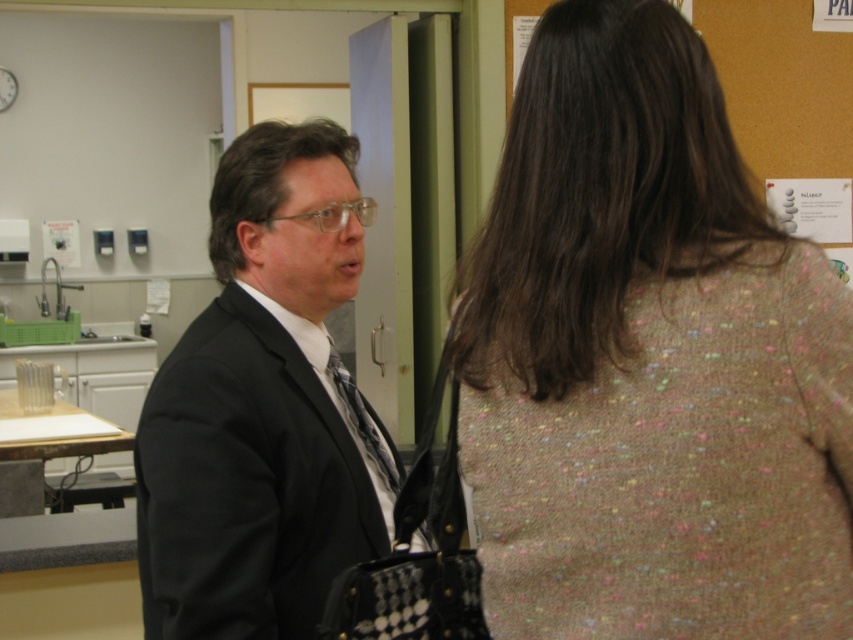
Question: Based on their relative distances, which object is farther from the speckled wool sweater at upper right?

Choices:
 (A) patterned silk tie at center
 (B) black matte suit at center

Answer: (A)

Question: Which object is farther from the camera taking this photo?

Choices:
 (A) black matte suit at center
 (B) patterned silk tie at center

Answer: (B)

Question: Is black matte suit at center to the left of patterned silk tie at center from the viewer's perspective?

Choices:
 (A) no
 (B) yes

Answer: (B)

Question: Among these objects, which one is farthest from the camera?

Choices:
 (A) speckled wool sweater at upper right
 (B) black matte suit at center

Answer: (B)

Question: Is speckled wool sweater at upper right smaller than black matte suit at center?

Choices:
 (A) no
 (B) yes

Answer: (B)

Question: Is speckled wool sweater at upper right to the right of black matte suit at center from the viewer's perspective?

Choices:
 (A) yes
 (B) no

Answer: (A)